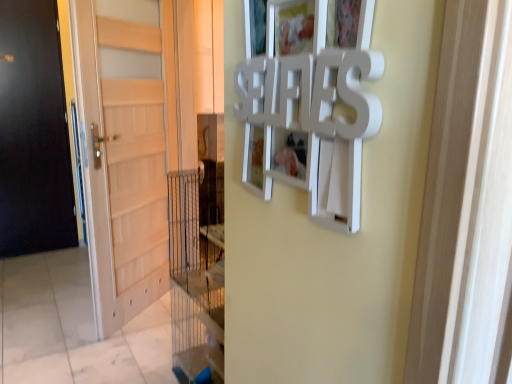
Question: From a real-world perspective, is white matte picture frame at upper center positioned above or below matte wood door at left?

Choices:
 (A) below
 (B) above

Answer: (B)

Question: In the image, is white matte picture frame at upper center positioned in front of or behind matte wood door at left?

Choices:
 (A) front
 (B) behind

Answer: (A)

Question: In terms of width, does white matte picture frame at upper center look wider or thinner when compared to matte wood door at left?

Choices:
 (A) thin
 (B) wide

Answer: (A)

Question: Considering the positions of matte wood door at left and white matte picture frame at upper center in the image, is matte wood door at left bigger or smaller than white matte picture frame at upper center?

Choices:
 (A) big
 (B) small

Answer: (A)

Question: From a real-world perspective, relative to white matte picture frame at upper center, is matte wood door at left vertically above or below?

Choices:
 (A) above
 (B) below

Answer: (B)

Question: From the image's perspective, is matte wood door at left above or below white matte picture frame at upper center?

Choices:
 (A) below
 (B) above

Answer: (A)

Question: Is matte wood door at left in front of or behind white matte picture frame at upper center in the image?

Choices:
 (A) front
 (B) behind

Answer: (B)